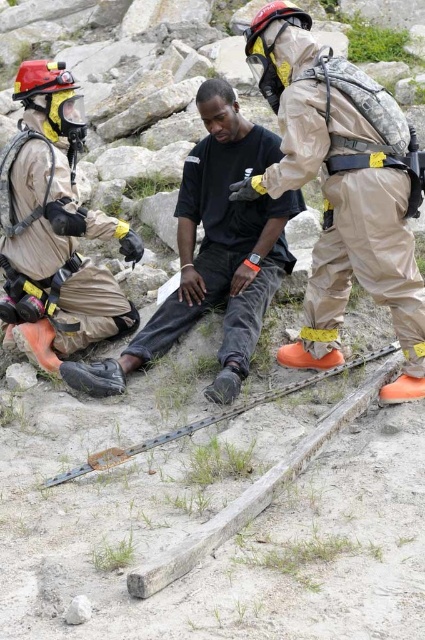
Question: Observing the image, what is the correct spatial positioning of tan protective suit at center in reference to black cotton shirt at center?

Choices:
 (A) below
 (B) above

Answer: (B)

Question: Does black cotton shirt at center have a smaller size compared to metal chain at center?

Choices:
 (A) no
 (B) yes

Answer: (A)

Question: Considering the real-world distances, which object is closest to the black cotton shirt at center?

Choices:
 (A) tan protective suit at left
 (B) tan protective suit at center

Answer: (A)

Question: Considering the real-world distances, which object is farthest from the tan protective suit at center?

Choices:
 (A) metal chain at center
 (B) tan protective suit at left
 (C) black cotton shirt at center

Answer: (B)

Question: Which object appears farthest from the camera in this image?

Choices:
 (A) tan protective suit at center
 (B) metal chain at center

Answer: (A)

Question: Is black cotton shirt at center positioned in front of metal chain at center?

Choices:
 (A) yes
 (B) no

Answer: (B)